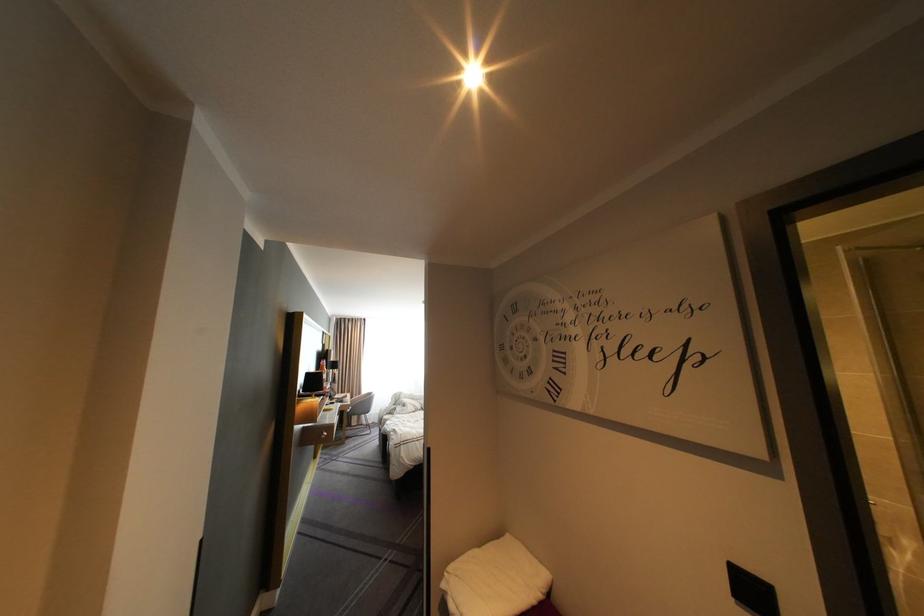
The height and width of the screenshot is (616, 924). Describe the element at coordinates (751, 591) in the screenshot. I see `the black wall switch` at that location.